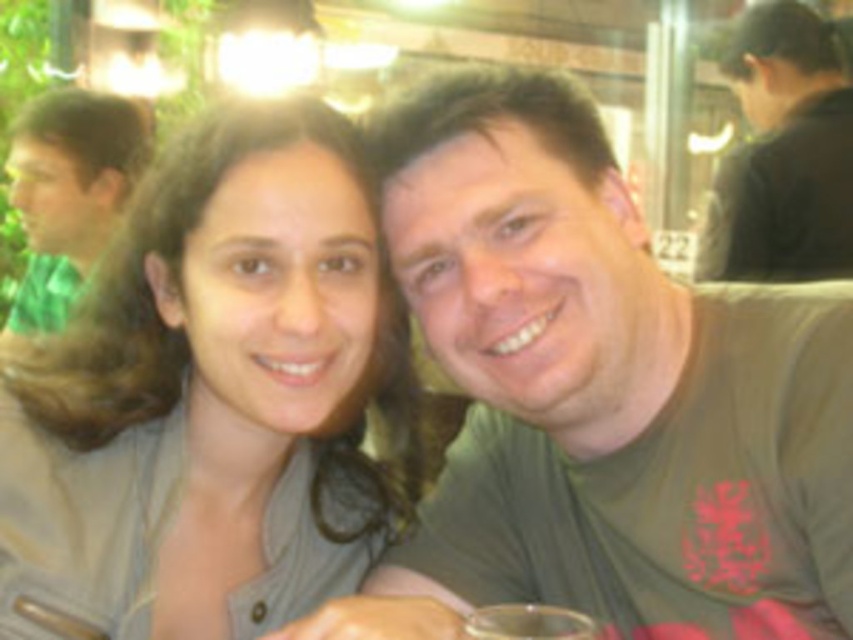
You are a photographer adjusting your camera settings to focus on two points in the image. The first point is point (28, 515) and the second point is point (519, 604). If you want to focus on the point that is closer to the camera, which coordinate should you choose?

Point (28, 515) is in front of point (519, 604), so you should focus on point (28, 515) since it is closer to the camera.

You are a photographer adjusting your camera settings to focus on the matte gray shirt at center. What coordinates should you set your focus point to?

The matte gray shirt at center should be focused at coordinates point [212,396].

You are a photographer setting up for a group photo and need to ensure all subjects are visible. Given the current arrangement where the matte gray shirt at center and the green matte shirt at left are positioned, which shirt should you ask to move closer to the camera to make them appear larger in the photo?

The matte gray shirt at center should be asked to move closer to the camera because it currently occupies less space, making it appear smaller. Moving closer would increase its apparent size in the photo.